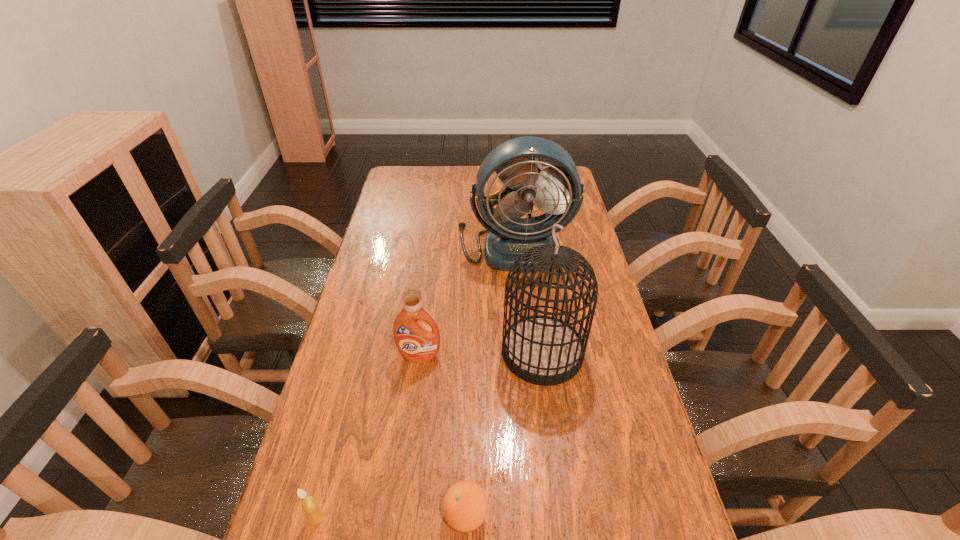
You are a GUI agent. You are given a task and a screenshot of the screen. Output one action in this format:
    pyautogui.click(x=<x>, y=<y>)
    Task: Click on the free space between the birdcage and the fourth tallest object
    The width and height of the screenshot is (960, 540).
    Given the screenshot: What is the action you would take?
    pyautogui.click(x=430, y=435)

The width and height of the screenshot is (960, 540). What are the coordinates of `free space that is in between the fan and the orange` in the screenshot? It's located at (491, 380).

At what (x,y) coordinates should I click in order to perform the action: click on unoccupied position between the orange and the farthest object. Please return your answer as a coordinate pair (x, y). The image size is (960, 540). Looking at the image, I should click on (491, 380).

Find the location of `free spot between the fourth tallest object and the birdcage`. free spot between the fourth tallest object and the birdcage is located at coordinates (430, 435).

Identify the location of vacant space that is in between the birdcage and the third shortest object. (481, 354).

You are a GUI agent. You are given a task and a screenshot of the screen. Output one action in this format:
    pyautogui.click(x=<x>, y=<y>)
    Task: Click on the free space between the leftmost object and the orange
    The height and width of the screenshot is (540, 960).
    Given the screenshot: What is the action you would take?
    pyautogui.click(x=392, y=516)

The image size is (960, 540). What are the coordinates of `free spot between the farthest object and the detergent` in the screenshot? It's located at (467, 301).

Locate an element on the screen. This screenshot has height=540, width=960. the closest object to the birdcage is located at coordinates (417, 342).

Locate which object is the closest to the fourth object from right to left. Please provide its 2D coordinates. Your answer should be formatted as a tuple, i.e. [(x, y)], where the tuple contains the x and y coordinates of a point satisfying the conditions above.

[(543, 350)]

Find the location of `vacant space that satisfies the following two spatial constraints: 1. in front of the birdcage to blow air; 2. on the left side of the farthest object`. vacant space that satisfies the following two spatial constraints: 1. in front of the birdcage to blow air; 2. on the left side of the farthest object is located at coordinates (525, 352).